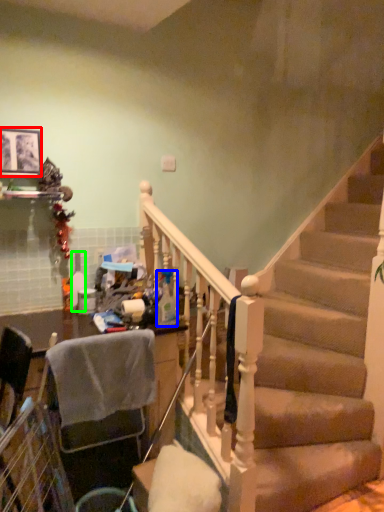
Question: Considering the real-world distances, which object is farthest from picture frame (highlighted by a red box)? bottle (highlighted by a blue box) or bottle (highlighted by a green box)?

Choices:
 (A) bottle
 (B) bottle

Answer: (A)